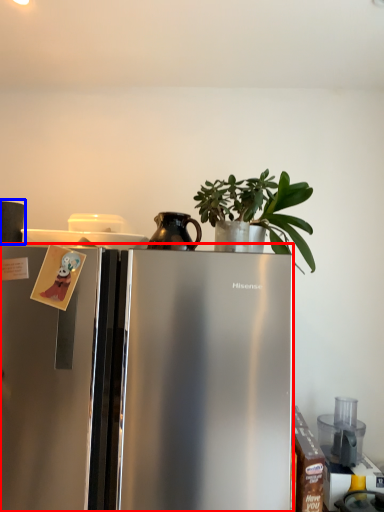
Question: Which object appears closest to the camera in this image, refrigerator (highlighted by a red box) or appliance (highlighted by a blue box)?

Choices:
 (A) refrigerator
 (B) appliance

Answer: (A)